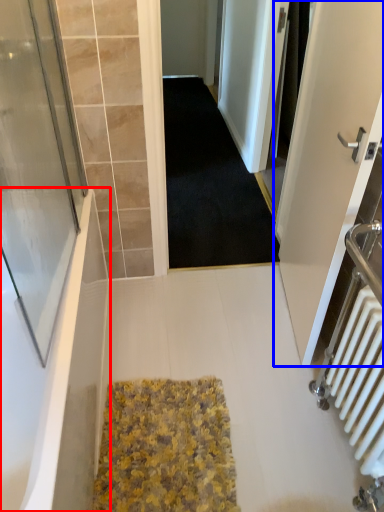
Question: Which point is closer to the camera, bathtub (highlighted by a red box) or door (highlighted by a blue box)?

Choices:
 (A) bathtub
 (B) door

Answer: (A)